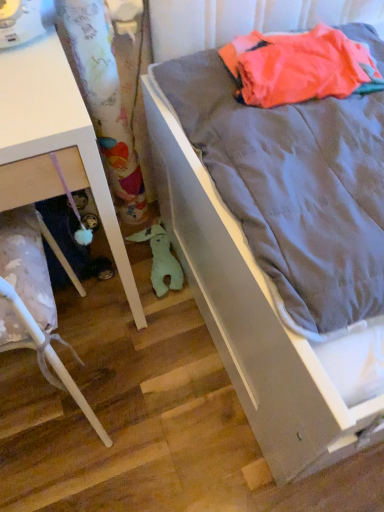
In order to click on free area in between white glossy drawer at lower left, the 2th furniture in the bottom-to-top sequence, and white glossy drawer at lower left, which appears as the 2th furniture when viewed from the top in this screenshot , I will do `click(125, 378)`.